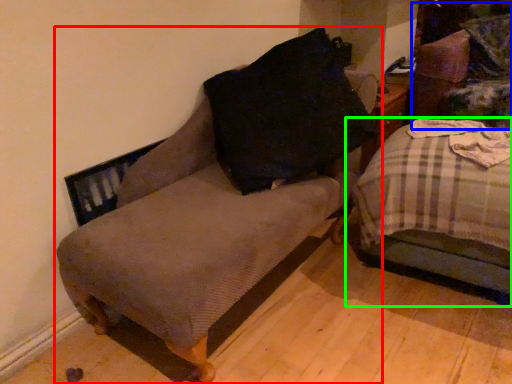
Question: Which is nearer to the furniture (highlighted by a red box)? swivel chair (highlighted by a blue box) or studio couch (highlighted by a green box).

Choices:
 (A) swivel chair
 (B) studio couch

Answer: (B)